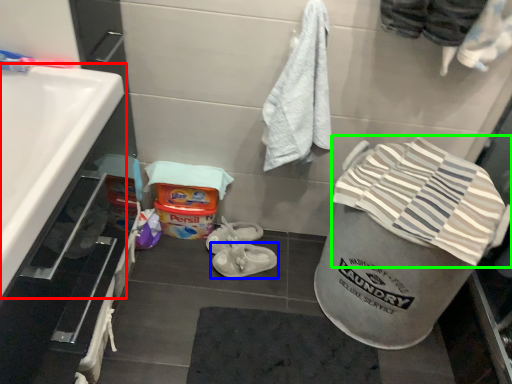
Question: Which object is positioned closest to sink (highlighted by a red box)? Select from footwear (highlighted by a blue box) and beach towel (highlighted by a green box).

Choices:
 (A) footwear
 (B) beach towel

Answer: (B)